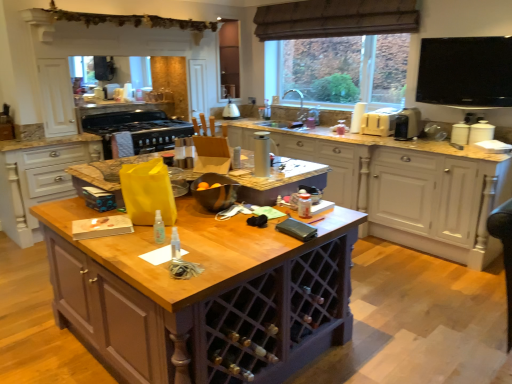
Identify the location of vacant region to the left of metallic silver toaster at right. The width and height of the screenshot is (512, 384). (384, 137).